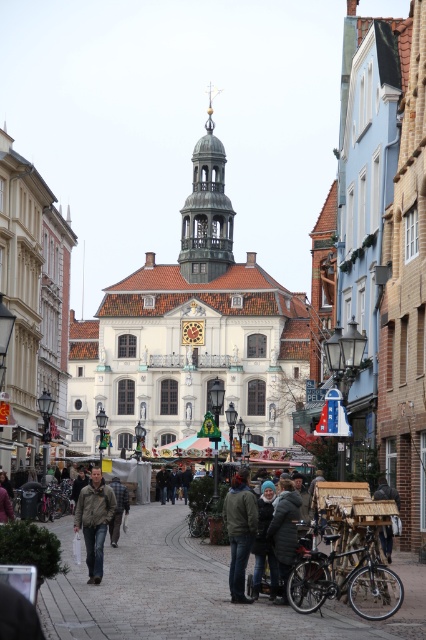
You are a tourist standing in the middle of the street looking towards the clock tower. You see two jackets hanging on a rack between you and the tower. Which jacket is closer to you, the dark green jacket at center or the leather jacket at center?

The dark green jacket at center is closer to you because it is in front of the leather jacket at center.

You are a photographer standing in the middle of the street, and you notice two jackets hanging on a rack in front of you. The jackets are the dark green jacket at center and the leather jacket at center. Which jacket is covering part of the other one?

The dark green jacket at center is positioned over the leather jacket at center, so it is covering part of the leather jacket at center.